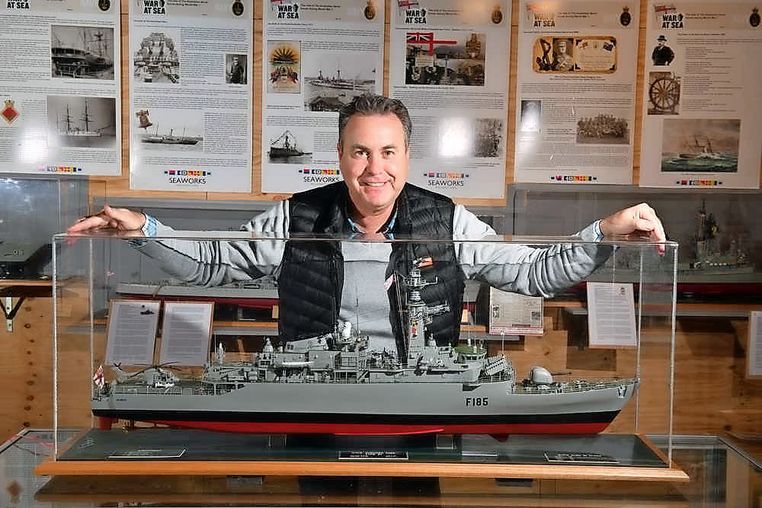
This screenshot has height=508, width=762. What are the coordinates of `leftmost poster` in the screenshot? It's located at coord(37,47).